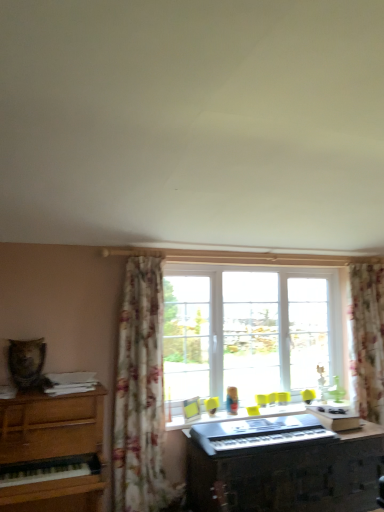
Question: From the image's perspective, is wooden piano at left located above or below black plastic musical keyboard at center?

Choices:
 (A) above
 (B) below

Answer: (B)

Question: Is point (51, 430) positioned closer to the camera than point (223, 450)?

Choices:
 (A) closer
 (B) farther

Answer: (A)

Question: Considering the real-world distances, which object is closest to the wooden piano at left?

Choices:
 (A) black plastic musical keyboard at center
 (B) clear glass window at center
 (C) floral fabric curtain at center, which is the 1th curtain in left-to-right order
 (D) floral fabric curtain at right, the second curtain in the left-to-right sequence
 (E) metallic silver keyboard at center

Answer: (C)

Question: Based on their relative distances, which object is farther from the floral fabric curtain at right, the second curtain in the left-to-right sequence?

Choices:
 (A) wooden piano at left
 (B) metallic silver keyboard at center
 (C) floral fabric curtain at center, which appears as the second curtain when viewed from the right
 (D) black plastic musical keyboard at center
 (E) clear glass window at center

Answer: (A)